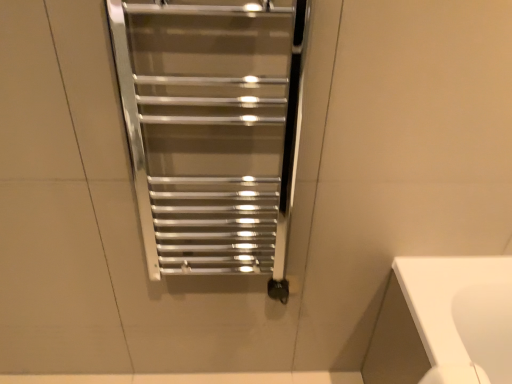
What are the coordinates of `polished metal towel rack at center` in the screenshot? It's located at (x=210, y=128).

What do you see at coordinates (210, 128) in the screenshot? I see `polished metal towel rack at center` at bounding box center [210, 128].

At what (x,y) coordinates should I click in order to perform the action: click on polished metal towel rack at center. Please return your answer as a coordinate pair (x, y). The width and height of the screenshot is (512, 384). Looking at the image, I should click on (210, 128).